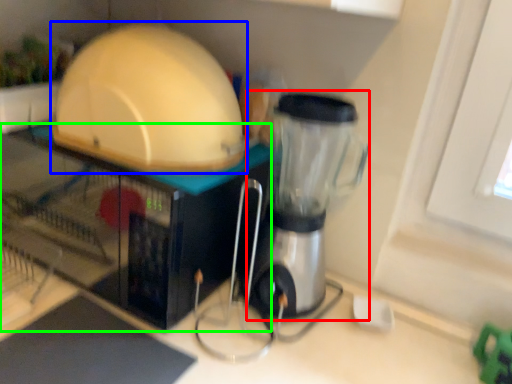
Question: Which object is the closest to the blender (highlighted by a red box)? Choose among these: appliance (highlighted by a blue box) or appliance (highlighted by a green box).

Choices:
 (A) appliance
 (B) appliance

Answer: (A)